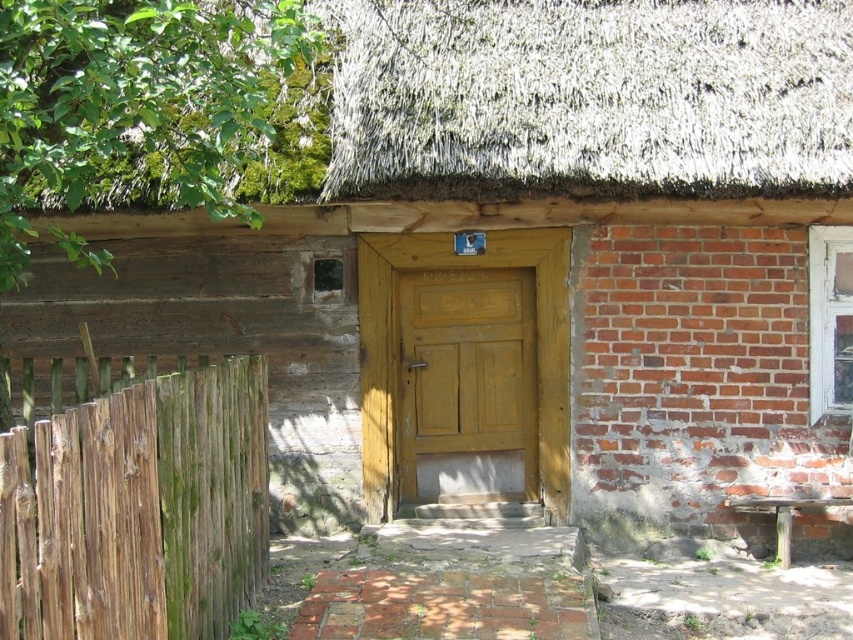
Question: Can you confirm if green mossy wood fence at left is wider than wooden door at center?

Choices:
 (A) no
 (B) yes

Answer: (A)

Question: Is thatched straw roof at upper center smaller than green mossy wood fence at left?

Choices:
 (A) yes
 (B) no

Answer: (B)

Question: Can you confirm if thatched straw roof at upper center is smaller than wooden door at center?

Choices:
 (A) no
 (B) yes

Answer: (A)

Question: Which point appears farthest from the camera in this image?

Choices:
 (A) (459, 321)
 (B) (769, 176)
 (C) (227, 397)

Answer: (A)

Question: Which object is the closest to the wooden door at center?

Choices:
 (A) green mossy wood fence at left
 (B) thatched straw roof at upper center

Answer: (B)

Question: Which of the following is the farthest from the observer?

Choices:
 (A) (439, 323)
 (B) (15, 492)

Answer: (A)